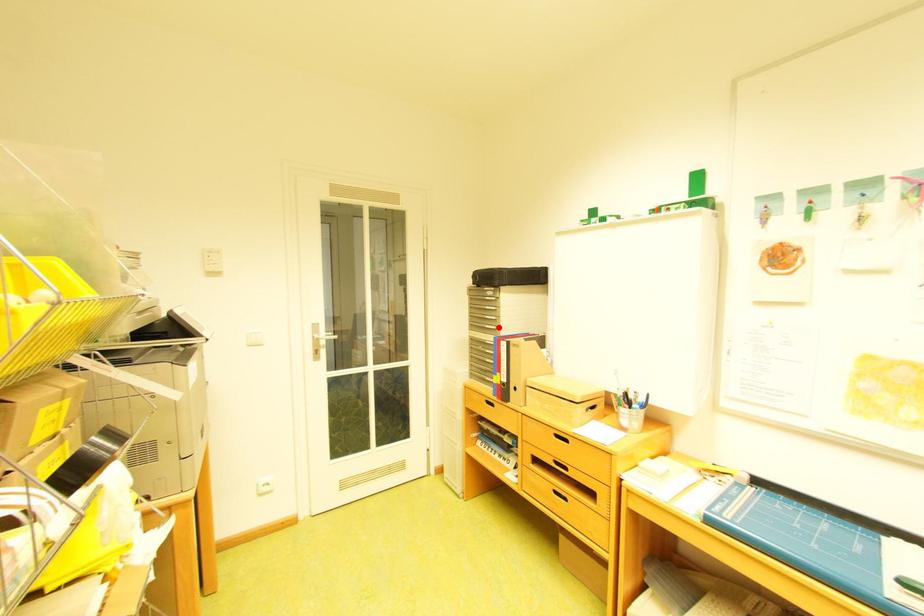
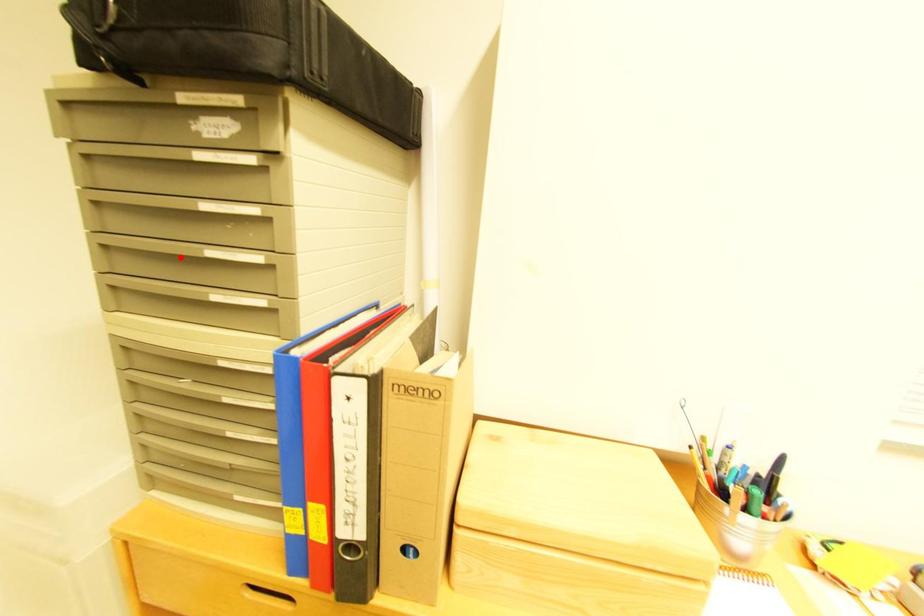
I am providing you with two images of the same scene from different viewpoints. A red point is marked on the first image and another point is marked on the second image. Are the points marked in image1 and image2 representing the same 3D position?

No